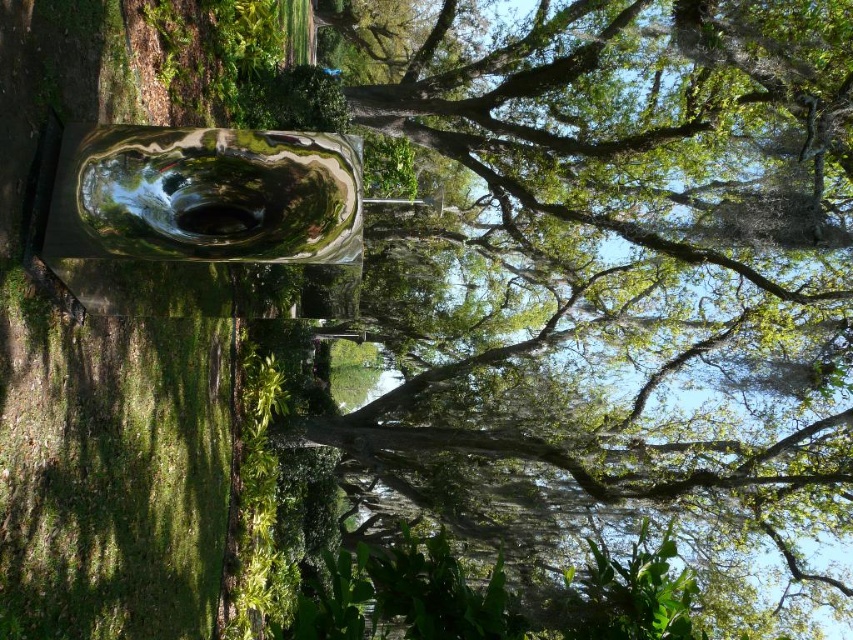
You are standing in the outdoor setting shown in the image. You want to place a small bench exactly at the center of the image. Will the bench overlap with the glossy metallic sculpture at center?

The glossy metallic sculpture at center is located at the center of the image, so placing a bench there would cause an overlap.

You are an artist planning to photograph the glossy metallic sculpture at center and the metallic reflective pool at center. You want to ensure both are fully visible in your composition. Given that the sculpture is wider than the pool, how should you position your camera to capture both objects without cropping either?

Since the glossy metallic sculpture at center is wider than the metallic reflective pool at center, position the camera closer to the sculpture to ensure its full width is captured while still framing the pool within the shot.

Based on the scene description, where is the glossy metallic sculpture located in relation to the point at coordinates [625,257]?

The glossy metallic sculpture at center is located at point [625,257].